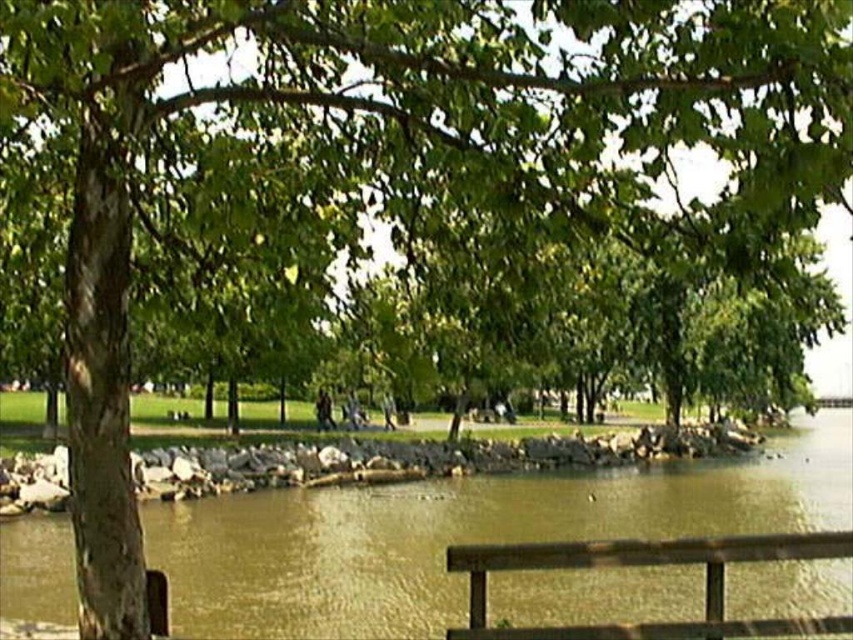
Question: Is the position of brown sedimentary rock at center less distant than that of brown wooden bench at lower right?

Choices:
 (A) no
 (B) yes

Answer: (A)

Question: Can you confirm if brown sedimentary rock at center is thinner than brown wooden bench at lower right?

Choices:
 (A) no
 (B) yes

Answer: (A)

Question: Which object is closer to the camera taking this photo?

Choices:
 (A) brown sedimentary rock at center
 (B) brown wooden bench at lower right

Answer: (B)

Question: Does brown sedimentary rock at center have a smaller size compared to brown wooden bench at lower right?

Choices:
 (A) no
 (B) yes

Answer: (A)